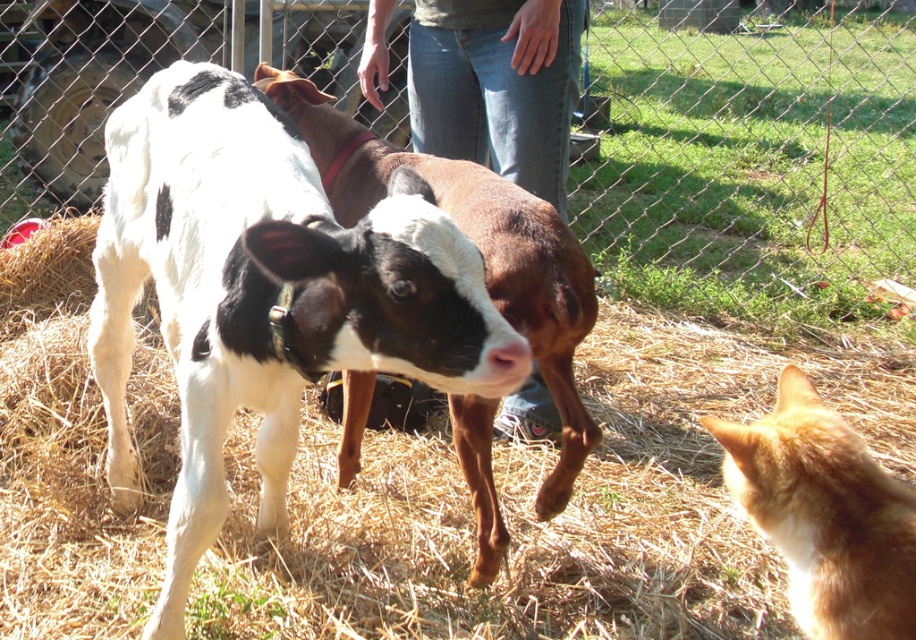
You are standing in the fenced area and want to throw a ball to a spot that is closer to the camera. Which of the two points, point (816, 28) or point (789, 490), should you aim for?

Point (816, 28) is further to the camera than point (789, 490), so you should aim for point (816, 28) to hit a spot closer to the camera.

You are a farmer checking the fence. You see the brown straw at center and the wire mesh fence at center. Which object is closer to the left side of the image?

The brown straw at center is closer to the left side of the image because it is positioned to the left of the wire mesh fence at center.

You are standing at the origin point of the image. You see two points marked in the scene. Which point is closer to you, point at coordinate point (795, 12) or point at coordinate point (458, 314)?

Point at coordinate point (458, 314) is closer to you because it is in front of point at coordinate point (795, 12).